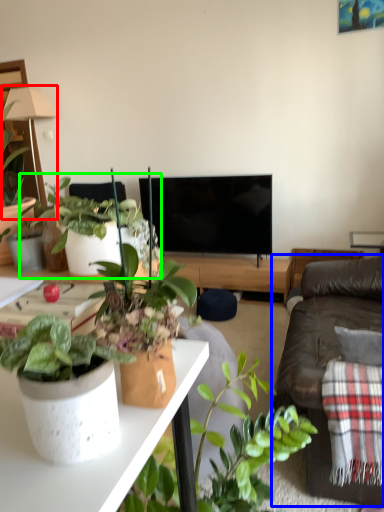
Question: Which object is the farthest from lamp (highlighted by a red box)? Choose among these: studio couch (highlighted by a blue box) or houseplant (highlighted by a green box).

Choices:
 (A) studio couch
 (B) houseplant

Answer: (A)